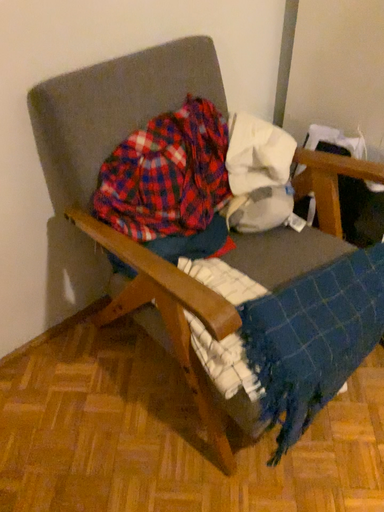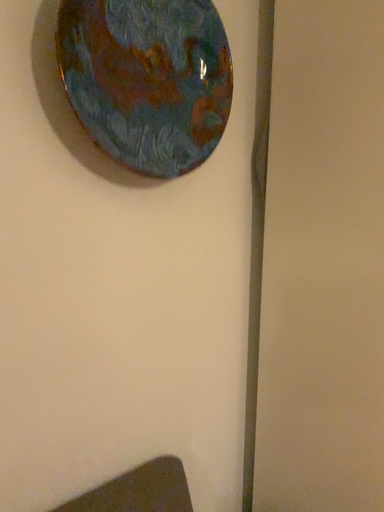
Question: Which way did the camera rotate in the video?

Choices:
 (A) rotated upward
 (B) rotated downward

Answer: (A)